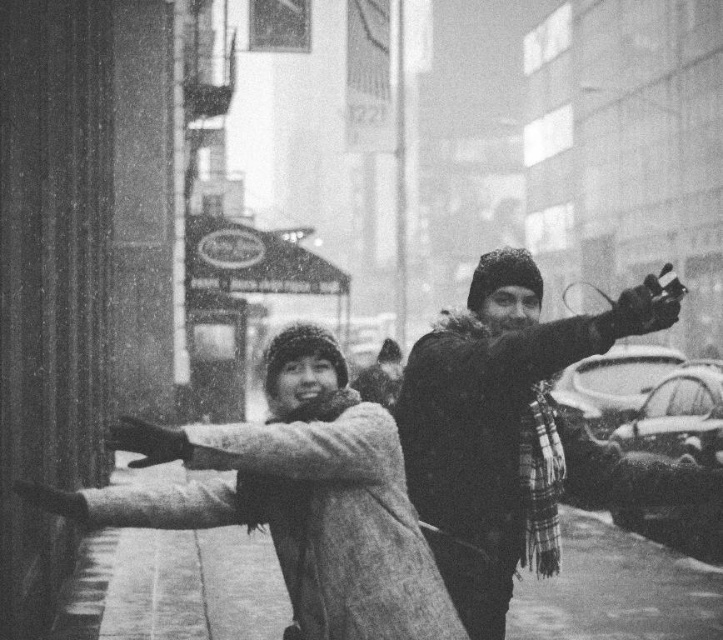
Question: Observing the image, what is the correct spatial positioning of fuzzy wool coat at center in reference to smooth concrete pavement at lower center?

Choices:
 (A) below
 (B) above

Answer: (B)

Question: Which of the following is the closest to the observer?

Choices:
 (A) (103, 596)
 (B) (231, 428)
 (C) (489, 570)

Answer: (B)

Question: Which object is the farthest from the smooth concrete pavement at lower center?

Choices:
 (A) fuzzy wool coat at center
 (B) fuzzy black coat at right

Answer: (A)

Question: Which object is closer to the camera taking this photo?

Choices:
 (A) fuzzy black coat at right
 (B) fuzzy wool coat at center

Answer: (B)

Question: Is fuzzy wool coat at center below smooth concrete pavement at lower center?

Choices:
 (A) yes
 (B) no

Answer: (B)

Question: Is fuzzy wool coat at center to the left of smooth concrete pavement at lower center from the viewer's perspective?

Choices:
 (A) yes
 (B) no

Answer: (B)